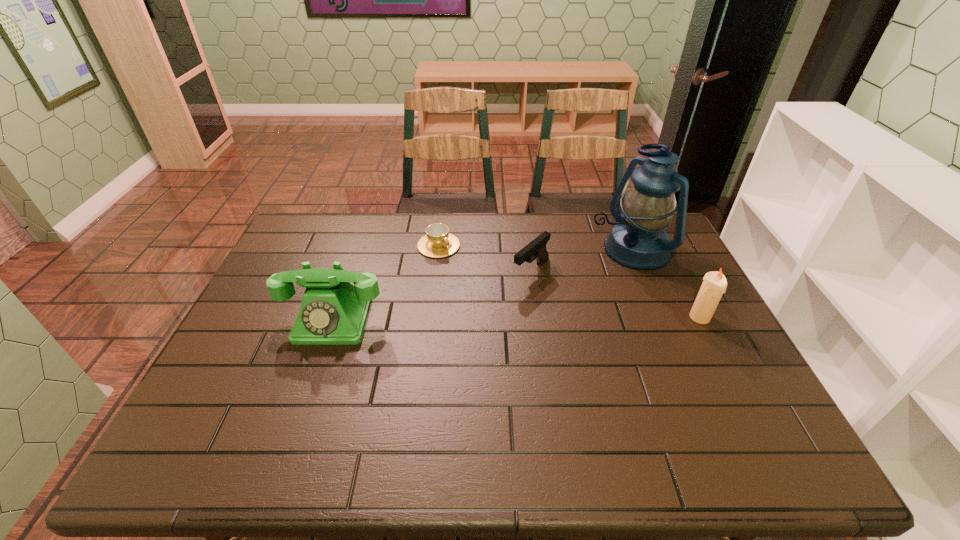
The height and width of the screenshot is (540, 960). I want to click on free space on the desktop that is between the leftmost object and the candle and is positioned with the handle on the side of the shortest object, so click(526, 318).

The image size is (960, 540). I want to click on vacant space on the desktop that is between the leftmost object and the candle and is positioned on the front-facing side of the fourth tallest object, so click(x=476, y=319).

Where is `free space on the desktop that is between the leftmost object and the candle and is positioned on the face of the lantern`? This screenshot has height=540, width=960. free space on the desktop that is between the leftmost object and the candle and is positioned on the face of the lantern is located at coordinates [503, 319].